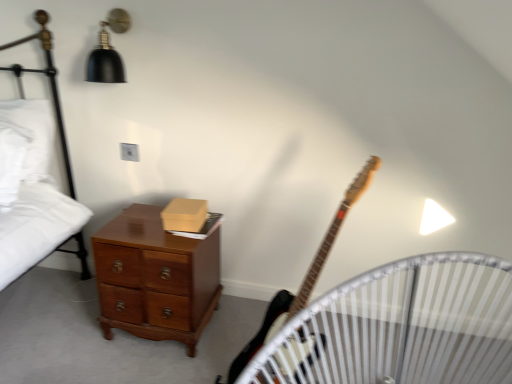
The image size is (512, 384). I want to click on vacant area that is in front of mahogany wooden chest of drawers at lower left, so click(122, 361).